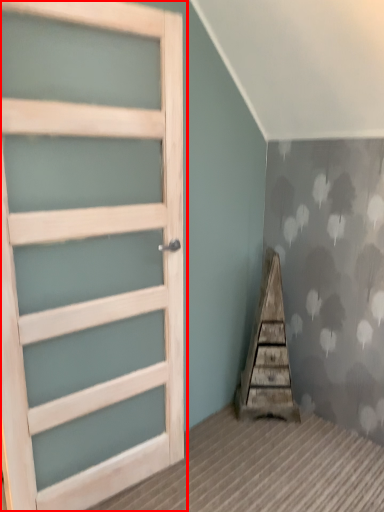
Question: From the image's perspective, where is door (annotated by the red box) located in relation to stairwell in the image?

Choices:
 (A) below
 (B) above

Answer: (B)